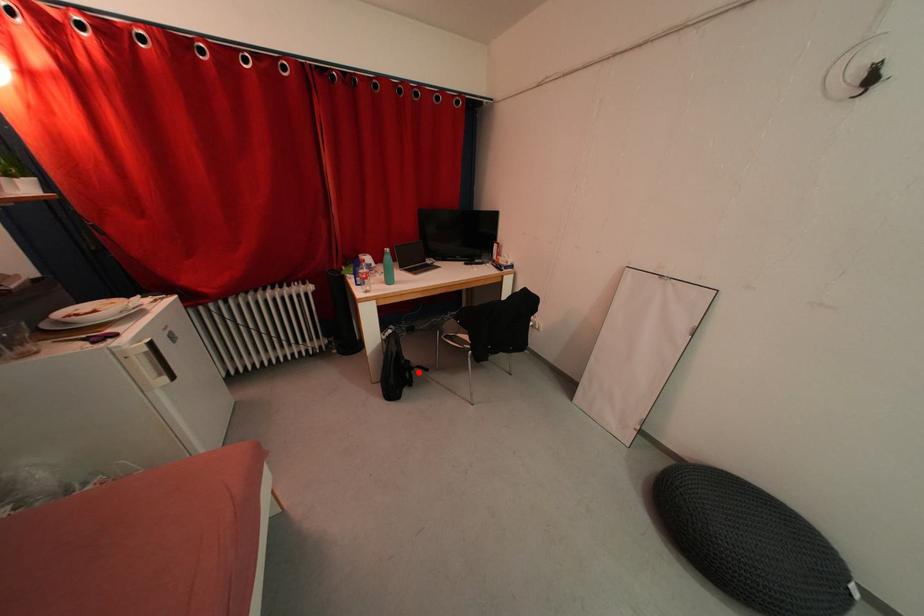
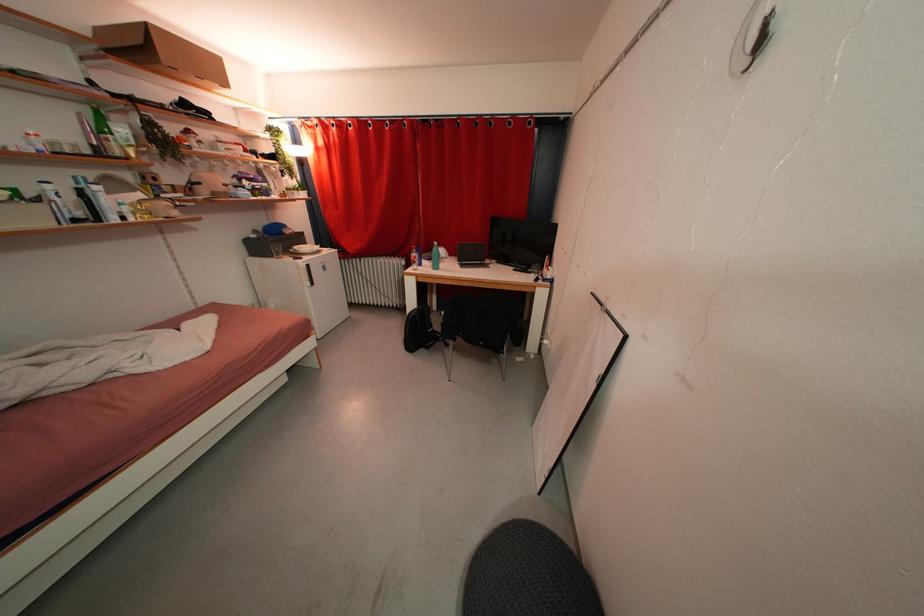
In the second image, find the point that corresponds to the highlighted location in the first image.

(444, 344)